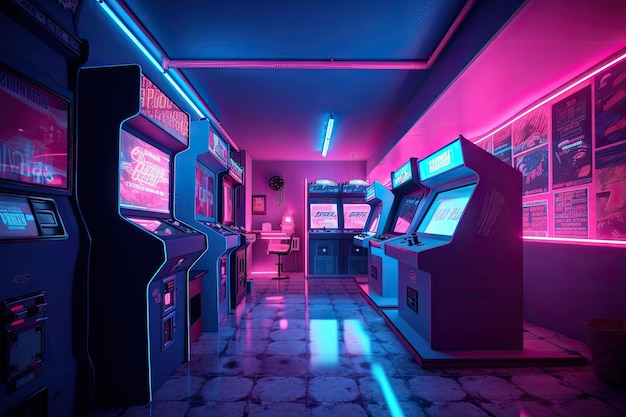
At what (x,y) coordinates should I click in order to perform the action: click on pink neon light. Please return your answer as a coordinate pair (x, y). Looking at the image, I should click on (520, 114), (567, 239), (270, 271).